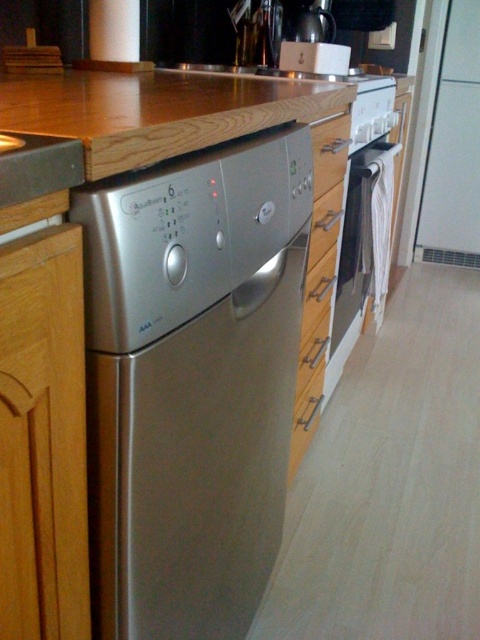
Question: Which object appears farthest from the camera in this image?

Choices:
 (A) satin wood drawer at center
 (B) white glossy oven at right
 (C) satin silver dishwasher at center

Answer: (B)

Question: Estimate the real-world distances between objects in this image. Which object is closer to the satin wood drawer at center?

Choices:
 (A) satin silver dishwasher at center
 (B) white glossy oven at right

Answer: (B)

Question: Considering the relative positions of satin silver dishwasher at center and satin wood drawer at center in the image provided, where is satin silver dishwasher at center located with respect to satin wood drawer at center?

Choices:
 (A) below
 (B) above

Answer: (A)

Question: Does brushed metal drawer at center appear over satin silver drawer at center?

Choices:
 (A) no
 (B) yes

Answer: (B)

Question: Does satin silver dishwasher at center come in front of satin wood drawer at center?

Choices:
 (A) no
 (B) yes

Answer: (B)

Question: Which point is farther from the camera taking this photo?

Choices:
 (A) (315, 202)
 (B) (264, 544)
 (C) (316, 177)
 (D) (313, 284)

Answer: (D)